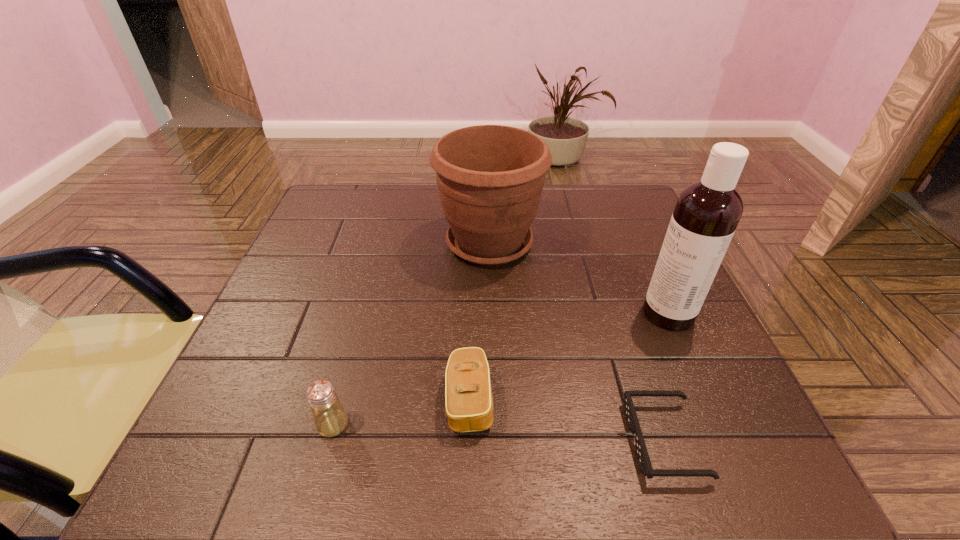
This screenshot has width=960, height=540. What are the coordinates of `free space at the near right corner of the desktop` in the screenshot? It's located at (773, 451).

Where is `vacant region between the saltshaker and the sunglasses`? vacant region between the saltshaker and the sunglasses is located at coordinates (498, 433).

Where is `free space that is in between the third tallest object and the fourth tallest object`? The image size is (960, 540). free space that is in between the third tallest object and the fourth tallest object is located at coordinates pos(401,412).

Identify the location of free spot between the saltshaker and the fourth tallest object. (401, 412).

The image size is (960, 540). Find the location of `vacant area between the shortest object and the second farthest object`. vacant area between the shortest object and the second farthest object is located at coordinates (666, 377).

At what (x,y) coordinates should I click in order to perform the action: click on free area in between the second farthest object and the shortest object. Please return your answer as a coordinate pair (x, y). The image size is (960, 540). Looking at the image, I should click on (x=666, y=377).

The image size is (960, 540). In order to click on free spot between the leftmost object and the fourth shortest object in this screenshot , I will do `click(411, 334)`.

Identify the location of unoccupied area between the second shortest object and the third tallest object. The width and height of the screenshot is (960, 540). (401, 412).

The image size is (960, 540). In order to click on free space between the second farthest object and the second shortest object in this screenshot , I will do `click(569, 356)`.

Image resolution: width=960 pixels, height=540 pixels. Find the location of `vacant area that lies between the shortest object and the second shortest object`. vacant area that lies between the shortest object and the second shortest object is located at coordinates (567, 420).